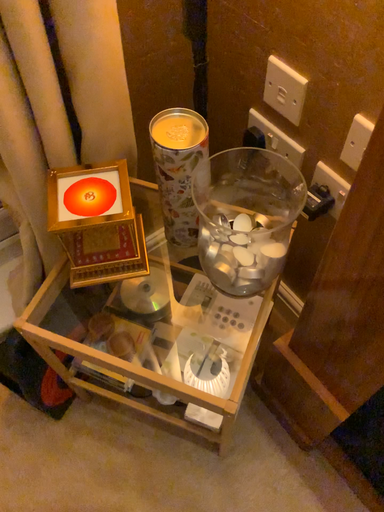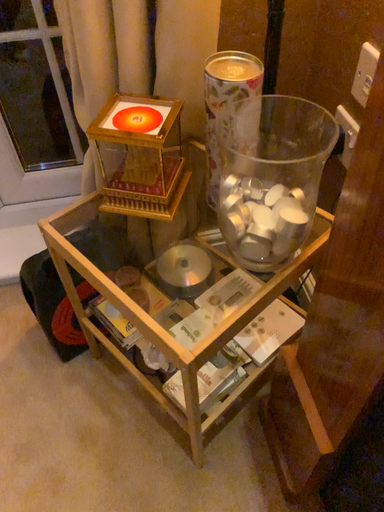
Question: How did the camera likely rotate when shooting the video?

Choices:
 (A) rotated upward
 (B) rotated downward

Answer: (A)